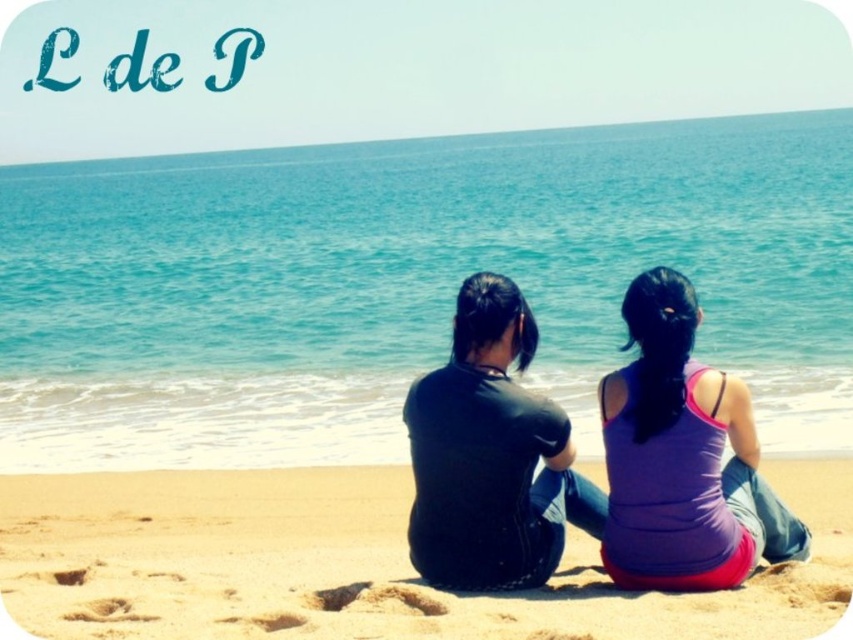
Question: Does sandy yellow sand at center have a smaller size compared to black matte shirt at center?

Choices:
 (A) yes
 (B) no

Answer: (B)

Question: Does purple fabric tank top at center have a smaller size compared to black matte shirt at center?

Choices:
 (A) yes
 (B) no

Answer: (A)

Question: Which point appears closest to the camera in this image?

Choices:
 (A) (469, 376)
 (B) (142, 497)
 (C) (636, 554)

Answer: (C)

Question: Considering the real-world distances, which object is closest to the purple fabric tank top at center?

Choices:
 (A) sandy yellow sand at center
 (B) black matte shirt at center

Answer: (B)

Question: Does sandy yellow sand at center have a lesser width compared to purple fabric tank top at center?

Choices:
 (A) no
 (B) yes

Answer: (A)

Question: Which object is the farthest from the black matte shirt at center?

Choices:
 (A) purple fabric tank top at center
 (B) sandy yellow sand at center

Answer: (B)